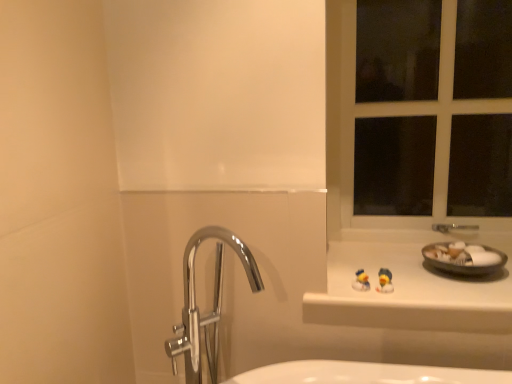
Question: Is white glossy counter top at upper right shorter than yellow rubber duck at center, the first miniature in the right-to-left sequence?

Choices:
 (A) no
 (B) yes

Answer: (B)

Question: Does white glossy counter top at upper right contain yellow rubber duck at center, the first miniature in the right-to-left sequence?

Choices:
 (A) no
 (B) yes

Answer: (A)

Question: Considering the relative sizes of white glossy counter top at upper right and yellow rubber duck at center, which appears as the second miniature when viewed from the left, in the image provided, is white glossy counter top at upper right wider than yellow rubber duck at center, which appears as the second miniature when viewed from the left,?

Choices:
 (A) yes
 (B) no

Answer: (A)

Question: From the image's perspective, is white glossy counter top at upper right under yellow rubber duck at center, which appears as the second miniature when viewed from the left?

Choices:
 (A) no
 (B) yes

Answer: (B)

Question: Can you confirm if white glossy counter top at upper right is smaller than yellow rubber duck at center, the first miniature in the right-to-left sequence?

Choices:
 (A) no
 (B) yes

Answer: (A)

Question: In terms of size, does yellow rubber duck at center, the first miniature in the right-to-left sequence, appear bigger or smaller than white glossy counter top at upper right?

Choices:
 (A) small
 (B) big

Answer: (A)

Question: Choose the correct answer: Is yellow rubber duck at center, which appears as the second miniature when viewed from the left, inside white glossy counter top at upper right or outside it?

Choices:
 (A) inside
 (B) outside

Answer: (B)

Question: In the image, is yellow rubber duck at center, which appears as the second miniature when viewed from the left, on the left side or the right side of white glossy counter top at upper right?

Choices:
 (A) right
 (B) left

Answer: (B)

Question: Is point (385, 291) closer or farther from the camera than point (360, 291)?

Choices:
 (A) farther
 (B) closer

Answer: (B)

Question: From the image's perspective, relative to yellow rubber duck at center, the first miniature in the right-to-left sequence, is polished chrome tap at center above or below?

Choices:
 (A) below
 (B) above

Answer: (A)

Question: Considering the relative positions of polished chrome tap at center and yellow rubber duck at center, the first miniature in the right-to-left sequence, in the image provided, is polished chrome tap at center to the left or to the right of yellow rubber duck at center, the first miniature in the right-to-left sequence,?

Choices:
 (A) left
 (B) right

Answer: (A)

Question: In terms of height, does polished chrome tap at center look taller or shorter compared to yellow rubber duck at center, the first miniature in the right-to-left sequence?

Choices:
 (A) short
 (B) tall

Answer: (B)

Question: Looking at the image, does polished chrome tap at center seem bigger or smaller compared to yellow rubber duck at center, the first miniature in the right-to-left sequence?

Choices:
 (A) big
 (B) small

Answer: (A)

Question: Is matte gray bowl at right in front of or behind polished chrome tap at center in the image?

Choices:
 (A) front
 (B) behind

Answer: (B)

Question: From a real-world perspective, is matte gray bowl at right physically located above or below polished chrome tap at center?

Choices:
 (A) above
 (B) below

Answer: (A)